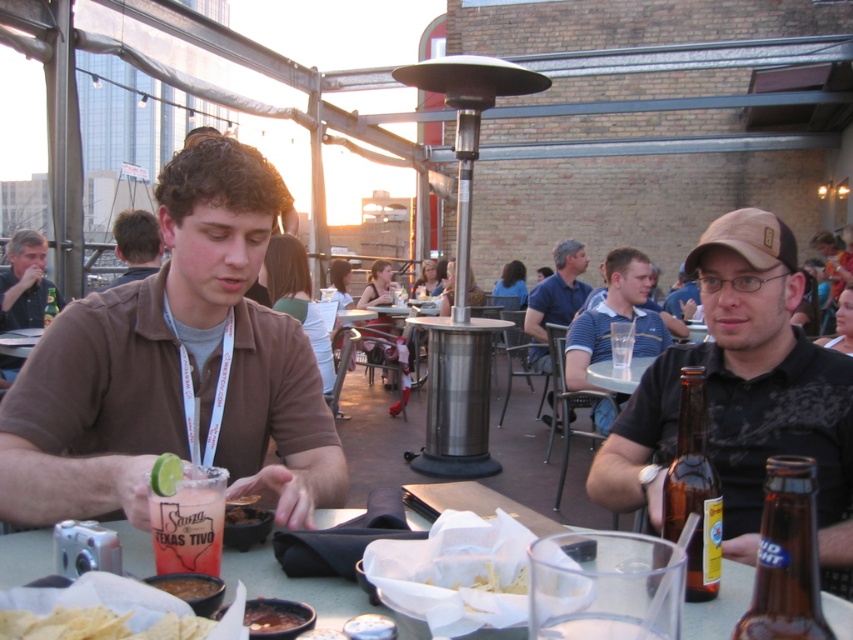
Is brown glass bottle at lower right above smooth brown tortilla chips at lower left?

Yes, brown glass bottle at lower right is above smooth brown tortilla chips at lower left.

Does point (711, 476) lie behind point (178, 579)?

Yes.

Is point (711, 595) positioned behind point (186, 580)?

Yes, point (711, 595) is farther from viewer.

The image size is (853, 640). Identify the location of brown glass bottle at lower right. (694, 490).

Who is shorter, clear glass at center or translucent glass margarita at center?

Standing shorter between the two is clear glass at center.

Is clear glass at center bigger than translucent glass margarita at center?

Yes.

Measure the distance between clear glass at center and camera.

clear glass at center and camera are 37.47 inches apart from each other.

At what (x,y) coordinates should I click in order to perform the action: click on clear glass at center. Please return your answer as a coordinate pair (x, y). The image size is (853, 640). Looking at the image, I should click on point(291,586).

Which is below, brown glass beer bottle at lower right or brown glass bottle at lower right?

Positioned lower is brown glass beer bottle at lower right.

Does brown glass beer bottle at lower right come in front of brown glass bottle at lower right?

Yes, it is.

Between point (770, 582) and point (711, 577), which one is positioned behind?

Positioned behind is point (711, 577).

I want to click on brown glass beer bottle at lower right, so click(786, 557).